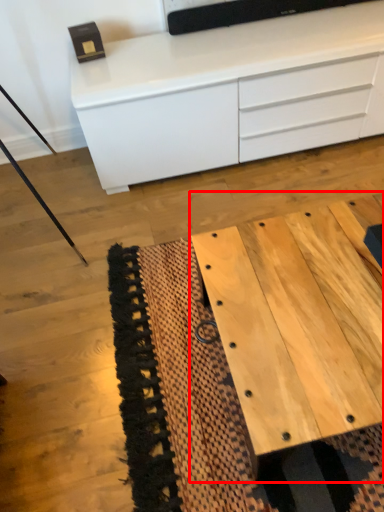
Question: From the image's perspective, what is the correct spatial positioning of table (annotated by the red box) in reference to chest of drawers?

Choices:
 (A) above
 (B) below

Answer: (B)